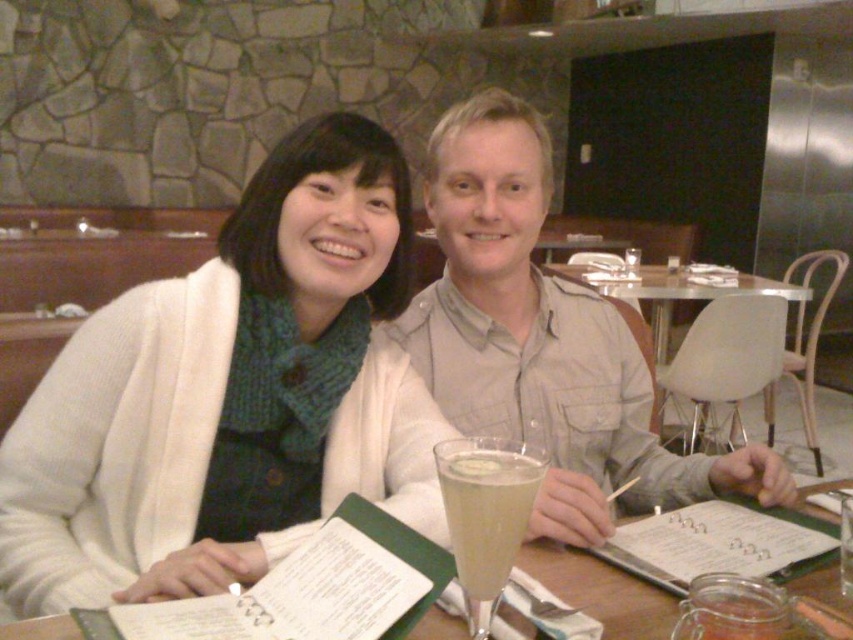
Question: Is clear glass table at center behind white plastic chair at center?

Choices:
 (A) yes
 (B) no

Answer: (B)

Question: Which is farther from the white plastic chair at center?

Choices:
 (A) clear glass champagne flute at center
 (B) clear glass table at center

Answer: (A)

Question: Can you confirm if clear glass champagne flute at center is thinner than white plastic chair at center?

Choices:
 (A) no
 (B) yes

Answer: (B)

Question: Does matte gray shirt at center have a smaller size compared to clear glass table at center?

Choices:
 (A) no
 (B) yes

Answer: (A)

Question: Which point is closer to the camera taking this photo?

Choices:
 (A) (49, 388)
 (B) (769, 472)
 (C) (770, 400)
 (D) (502, 588)

Answer: (D)

Question: Among these objects, which one is nearest to the camera?

Choices:
 (A) white knit sweater at upper left
 (B) white plastic chair at center
 (C) clear glass champagne flute at center
 (D) matte gray shirt at center

Answer: (C)